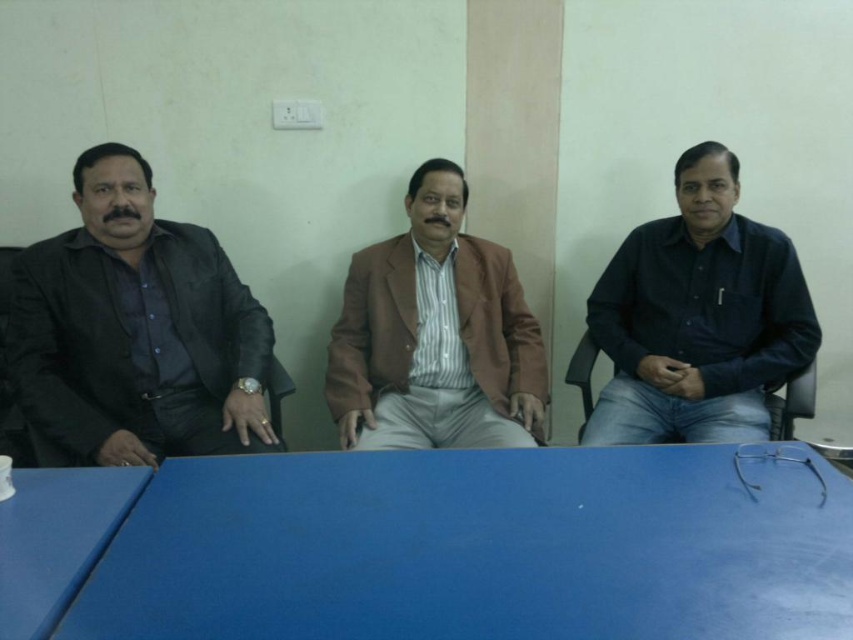
You are a photographer setting up for a group portrait. You need to position a tripod in front of the blue plastic table at lower left so it doesn not block the brown textured blazer at center. Where should you place the tripod?

The blue plastic table at lower left is behind the brown textured blazer at center, so you should place the tripod in front of the blue plastic table at lower left but ensure it is positioned closer to the front of the table to avoid blocking the view of the brown textured blazer at center.

You are standing in front of the wall with the electrical outlet. You need to place a small object on the matte black jacket at left. Based on the wall colors, where should you place it to ensure it lands on the light greenish section?

The matte black jacket at left is located at point (136, 332), which is on the light greenish section of the wall. Therefore, placing the object there will ensure it lands on the light greenish area.